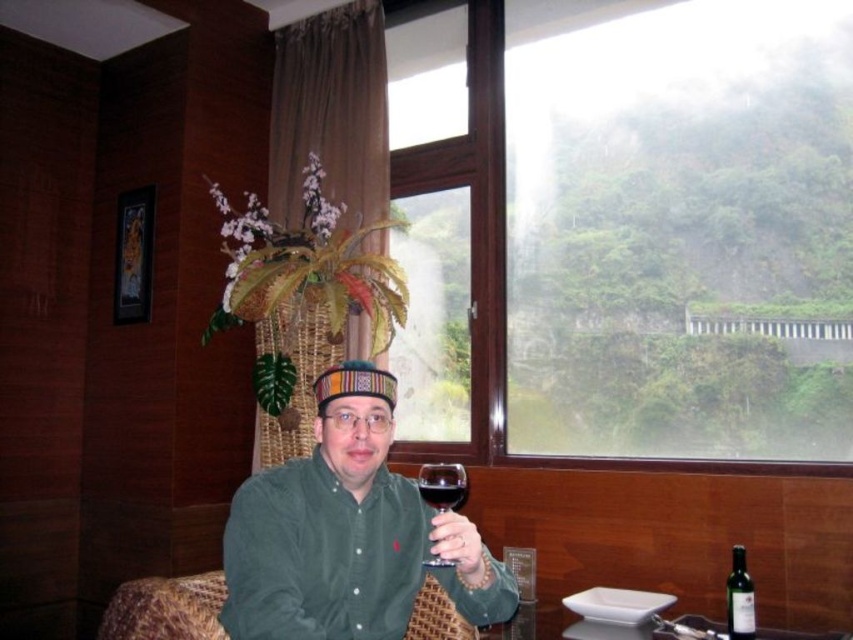
Question: Observing the image, what is the correct spatial positioning of green corduroy shirt at center in reference to transparent glass at center?

Choices:
 (A) below
 (B) above

Answer: (A)

Question: Which of the following is the farthest from the observer?

Choices:
 (A) (456, 502)
 (B) (350, 365)
 (C) (426, 490)

Answer: (B)

Question: Is transparent glass at center positioned at the back of dark red glass at center?

Choices:
 (A) yes
 (B) no

Answer: (B)

Question: Among these points, which one is farthest from the camera?

Choices:
 (A) (399, 577)
 (B) (749, 611)
 (C) (416, 476)
 (D) (451, 499)

Answer: (C)

Question: Can you confirm if green corduroy shirt at center is positioned to the left of green glass bottle at lower right?

Choices:
 (A) yes
 (B) no

Answer: (A)

Question: Which of the following is the farthest from the observer?

Choices:
 (A) green glass bottle at lower right
 (B) transparent glass at center

Answer: (A)